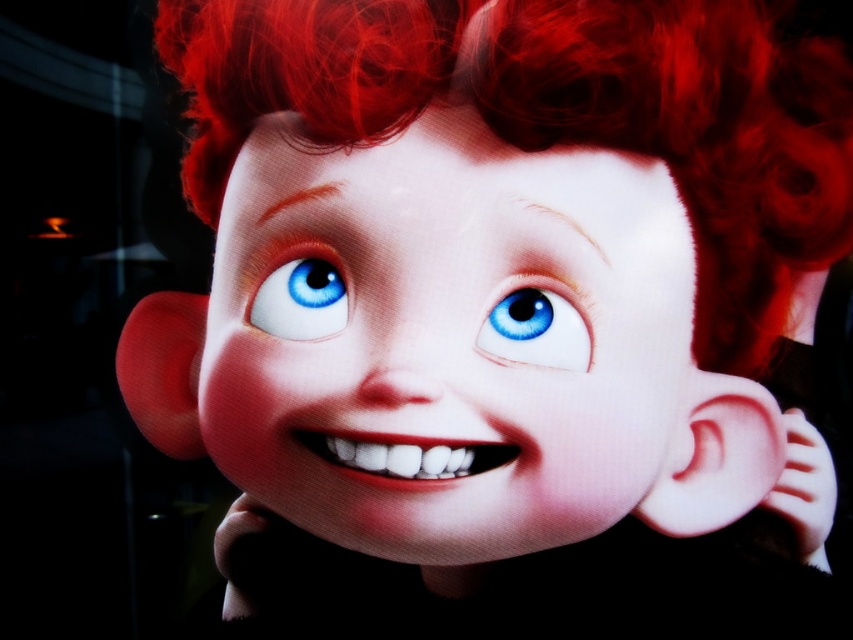
Can you confirm if blue glossy eye at center is positioned to the left of blue glossy eye at upper center?

No, blue glossy eye at center is not to the left of blue glossy eye at upper center.

Between point (543, 364) and point (297, 333), which one is positioned in front?

Point (543, 364) is more forward.

Image resolution: width=853 pixels, height=640 pixels. Find the location of `blue glossy eye at center`. blue glossy eye at center is located at coordinates (537, 330).

The image size is (853, 640). Describe the element at coordinates (450, 340) in the screenshot. I see `smooth skin face at center` at that location.

Which is in front, point (364, 200) or point (308, 259)?

Point (364, 200) is more forward.

Describe the element at coordinates (450, 340) in the screenshot. I see `smooth skin face at center` at that location.

Identify the location of smooth skin face at center. Image resolution: width=853 pixels, height=640 pixels. (450, 340).

This screenshot has height=640, width=853. What do you see at coordinates (450, 340) in the screenshot?
I see `smooth skin face at center` at bounding box center [450, 340].

Between smooth skin face at center and blue glossy eye at center, which one is positioned higher?

Positioned higher is blue glossy eye at center.

Which is behind, point (363, 484) or point (546, 340)?

The point (363, 484) is behind.

This screenshot has width=853, height=640. I want to click on smooth skin face at center, so click(x=450, y=340).